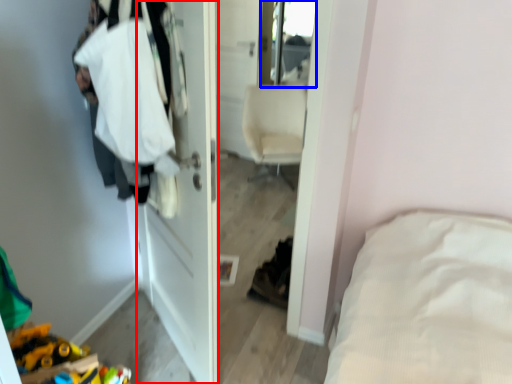
Question: Which point is further to the camera, door (highlighted by a red box) or mirror (highlighted by a blue box)?

Choices:
 (A) door
 (B) mirror

Answer: (B)